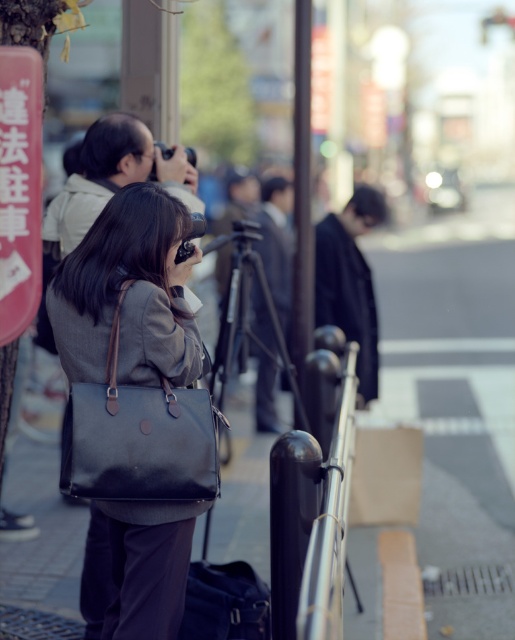
At what (x,y) coordinates should I click in order to perform the action: click on dark brown canvas bag at center. Please return your answer as a coordinate pair (x, y). Looking at the image, I should click on (139, 436).

Can you confirm if dark brown canvas bag at center is positioned above matte brown bag at center?

No.

The height and width of the screenshot is (640, 515). Describe the element at coordinates (139, 436) in the screenshot. I see `dark brown canvas bag at center` at that location.

The image size is (515, 640). What are the coordinates of `dark brown canvas bag at center` in the screenshot? It's located at (139, 436).

Is point (111, 595) closer to camera compared to point (331, 436)?

Yes.

Is matte brown bag at center taller than polished metal railing at center?

Yes.

Between point (91, 536) and point (335, 481), which one is positioned behind?

The point (91, 536) is behind.

Identify the location of matte brown bag at center. tap(111, 260).

Does dark brown canvas bag at center come behind polished metal railing at center?

No, dark brown canvas bag at center is closer to the viewer.

Can you confirm if dark brown canvas bag at center is positioned below polished metal railing at center?

No, dark brown canvas bag at center is not below polished metal railing at center.

The image size is (515, 640). What do you see at coordinates (139, 436) in the screenshot?
I see `dark brown canvas bag at center` at bounding box center [139, 436].

Where is `dark brown canvas bag at center`? This screenshot has height=640, width=515. dark brown canvas bag at center is located at coordinates (139, 436).